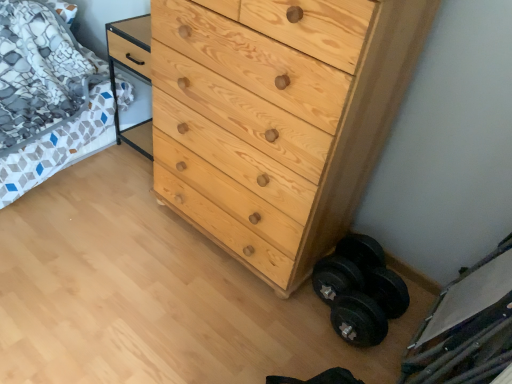
Question: Does natural wood chest of drawers at center appear on the right side of black rubber dumbbell at lower right?

Choices:
 (A) no
 (B) yes

Answer: (A)

Question: Would you say natural wood chest of drawers at center contains black rubber dumbbell at lower right?

Choices:
 (A) no
 (B) yes

Answer: (A)

Question: Can you confirm if natural wood chest of drawers at center is smaller than black rubber dumbbell at lower right?

Choices:
 (A) no
 (B) yes

Answer: (A)

Question: From the image's perspective, is natural wood chest of drawers at center below black rubber dumbbell at lower right?

Choices:
 (A) no
 (B) yes

Answer: (A)

Question: From the image's perspective, is natural wood chest of drawers at center located above black rubber dumbbell at lower right?

Choices:
 (A) yes
 (B) no

Answer: (A)

Question: Is natural wood chest of drawers at center with black rubber dumbbell at lower right?

Choices:
 (A) yes
 (B) no

Answer: (B)

Question: Does patterned fabric bed at left have a lesser height compared to black rubber dumbbell at lower right?

Choices:
 (A) no
 (B) yes

Answer: (A)

Question: Is patterned fabric bed at left thinner than black rubber dumbbell at lower right?

Choices:
 (A) no
 (B) yes

Answer: (A)

Question: From the image's perspective, would you say patterned fabric bed at left is shown under black rubber dumbbell at lower right?

Choices:
 (A) yes
 (B) no

Answer: (B)

Question: From a real-world perspective, is patterned fabric bed at left physically above black rubber dumbbell at lower right?

Choices:
 (A) yes
 (B) no

Answer: (A)

Question: Can you confirm if patterned fabric bed at left is wider than black rubber dumbbell at lower right?

Choices:
 (A) no
 (B) yes

Answer: (B)

Question: Is patterned fabric bed at left facing towards black rubber dumbbell at lower right?

Choices:
 (A) no
 (B) yes

Answer: (A)

Question: From a real-world perspective, does natural wood chest of drawers at center sit lower than patterned fabric bed at left?

Choices:
 (A) no
 (B) yes

Answer: (A)